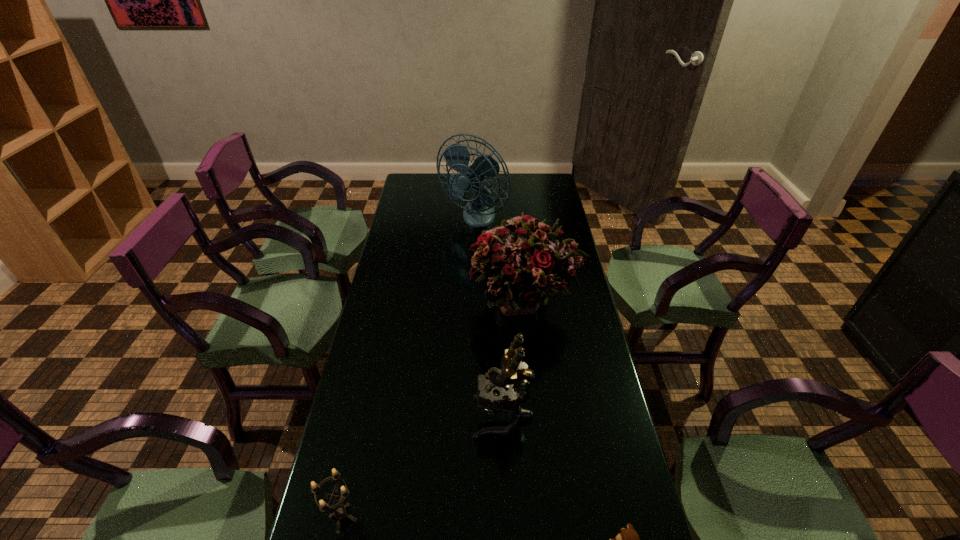
Locate an element on the screen. The image size is (960, 540). the tallest object is located at coordinates 479,212.

The image size is (960, 540). I want to click on fan, so click(479, 212).

You are a GUI agent. You are given a task and a screenshot of the screen. Output one action in this format:
    pyautogui.click(x=<x>, y=<y>)
    Task: Click on the bouquet
    
    Given the screenshot: What is the action you would take?
    pyautogui.click(x=521, y=260)

This screenshot has width=960, height=540. What are the coordinates of `the third nearest object` in the screenshot? It's located at (495, 391).

Identify the location of candle holder. Image resolution: width=960 pixels, height=540 pixels. (341, 513).

In order to click on the leftmost object in this screenshot , I will do (x=341, y=513).

Find the location of a particular element. This screenshot has height=540, width=960. free space located in front of the farthest object to blow air is located at coordinates (471, 278).

You are a GUI agent. You are given a task and a screenshot of the screen. Output one action in this format:
    pyautogui.click(x=<x>, y=<y>)
    Task: Click on the free space located 0.080m on the back of the second farthest object
    
    Given the screenshot: What is the action you would take?
    pyautogui.click(x=520, y=256)

The height and width of the screenshot is (540, 960). Find the location of `free space located at the eyepieces of the microscope`. free space located at the eyepieces of the microscope is located at coordinates (368, 417).

I want to click on vacant space located 0.290m at the eyepieces of the microscope, so click(368, 417).